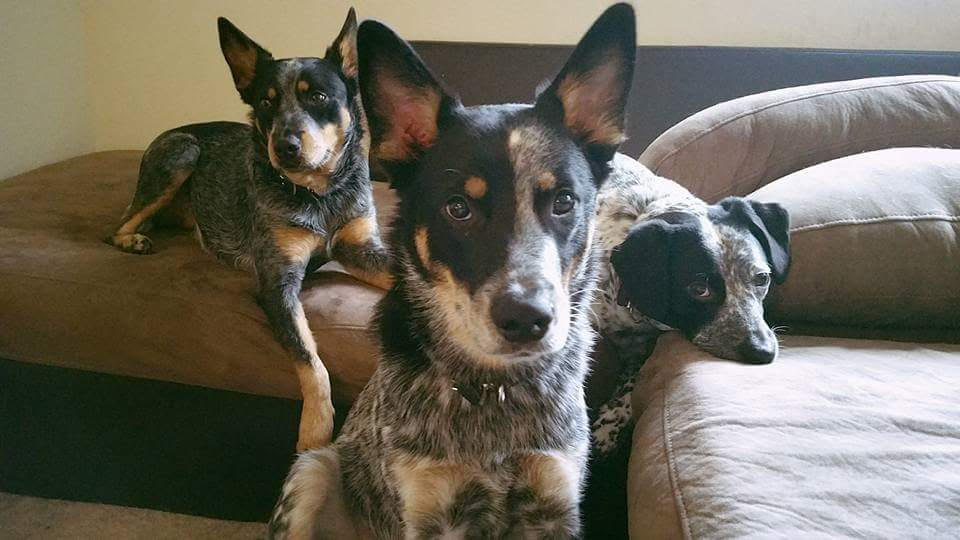
Image resolution: width=960 pixels, height=540 pixels. I want to click on tan walls, so click(x=759, y=18).